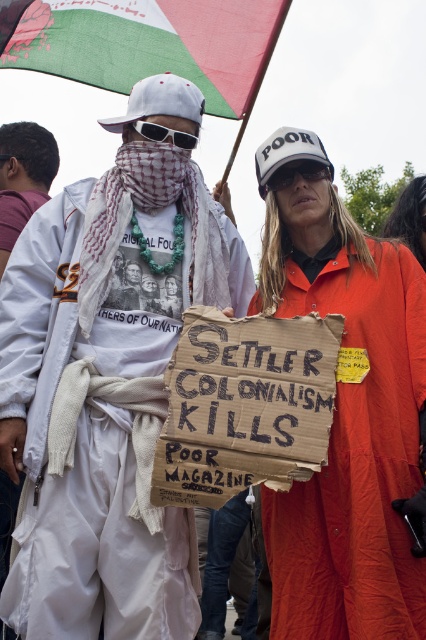
Which is in front, point (350, 337) or point (302, 163)?

Point (350, 337) is more forward.

Can you confirm if orange cotton robe at center is smaller than sunglassestransparent at upper center?

No.

Describe the element at coordinates (356, 458) in the screenshot. I see `orange cotton robe at center` at that location.

Where is `orange cotton robe at center`? orange cotton robe at center is located at coordinates (356, 458).

Which is below, white cotton robe at center or white fabric scarf at left?

white cotton robe at center

Does point (22, 355) come in front of point (2, 154)?

Yes, point (22, 355) is closer to viewer.

This screenshot has height=640, width=426. Find the location of `white cotton robe at center`. white cotton robe at center is located at coordinates (89, 444).

Can you confirm if sunglassestransparent at upper center is positioned above black plastic sunglasses at center?

Actually, sunglassestransparent at upper center is below black plastic sunglasses at center.

Consider the image. Who is positioned more to the right, sunglassestransparent at upper center or black plastic sunglasses at center?

From the viewer's perspective, sunglassestransparent at upper center appears more on the right side.

You are a GUI agent. You are given a task and a screenshot of the screen. Output one action in this format:
    pyautogui.click(x=<x>, y=<y>)
    Task: Click on the sunglassestransparent at upper center
    
    Given the screenshot: What is the action you would take?
    pyautogui.click(x=299, y=173)